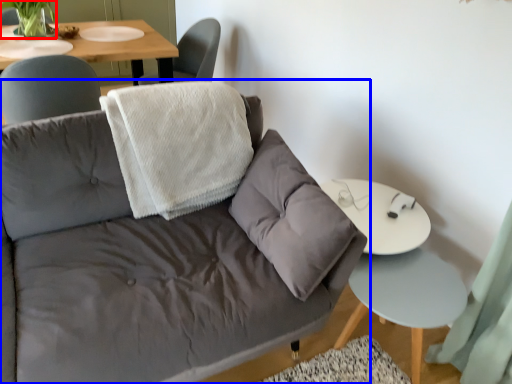
Question: Which point is further to the camera, plant (highlighted by a red box) or studio couch (highlighted by a blue box)?

Choices:
 (A) plant
 (B) studio couch

Answer: (A)